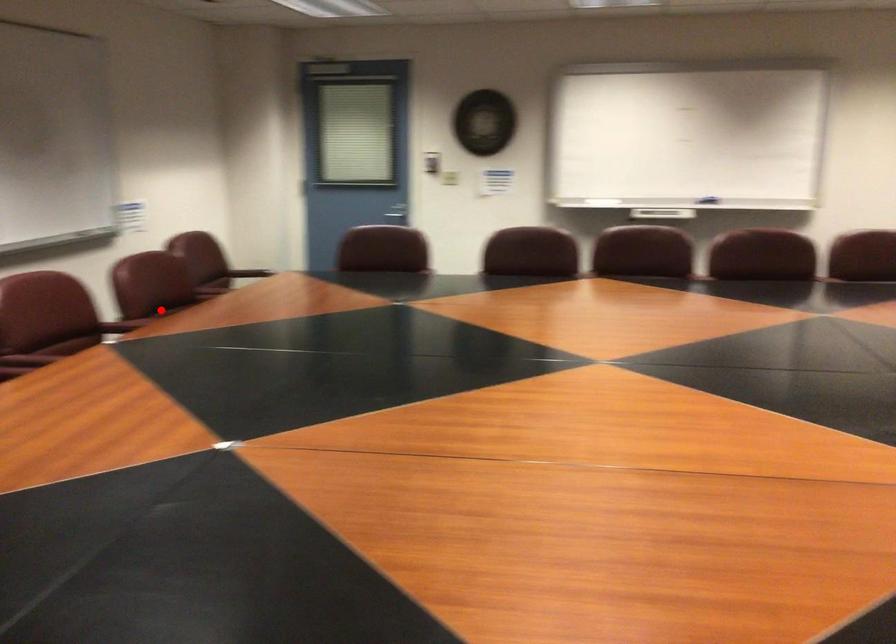
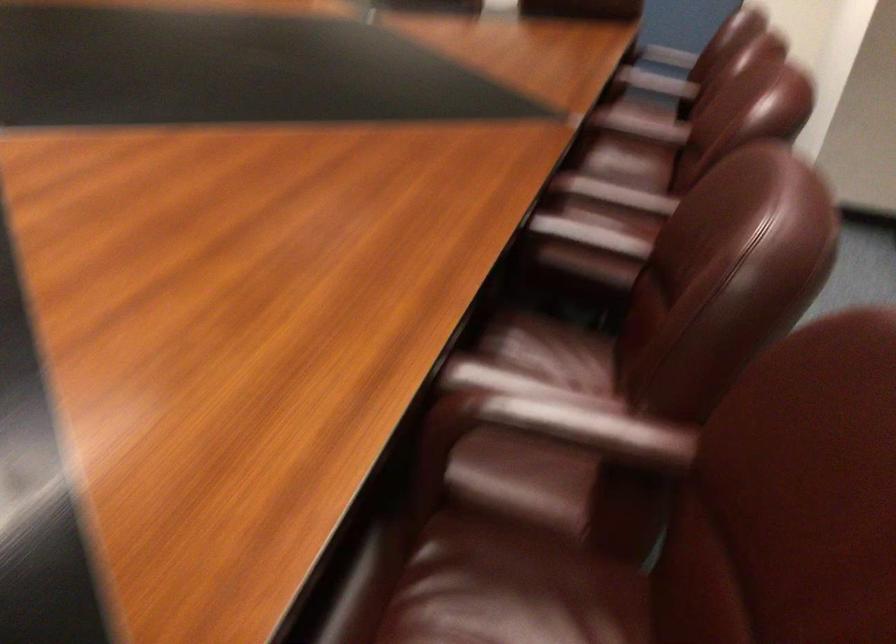
Question: A red point is marked in image1. In image2, is the corresponding 3D point closer to the camera or farther? Reply with the corresponding letter.

Choices:
 (A) The corresponding 3D point is closer.
 (B) The corresponding 3D point is farther.

Answer: (A)